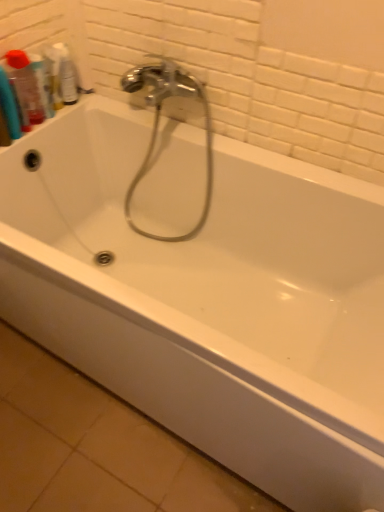
The height and width of the screenshot is (512, 384). Describe the element at coordinates (25, 88) in the screenshot. I see `translucent plastic mouthwash at upper left, the 3th mouthwash in the right-to-left sequence` at that location.

The image size is (384, 512). What do you see at coordinates (66, 75) in the screenshot? I see `clear plastic bottle at upper left, which is counted as the 3th mouthwash, starting from the left` at bounding box center [66, 75].

How much space does clear plastic bottle at upper left, marked as the first mouthwash in a right-to-left arrangement, occupy vertically?

The height of clear plastic bottle at upper left, marked as the first mouthwash in a right-to-left arrangement, is 18.47 centimeters.

Where is `chrome metallic faucet at center`? This screenshot has width=384, height=512. chrome metallic faucet at center is located at coordinates 158,124.

Considering the relative positions of clear plastic bottle at upper left, which is counted as the 3th mouthwash, starting from the left, and chrome metallic faucet at center in the image provided, is clear plastic bottle at upper left, which is counted as the 3th mouthwash, starting from the left, in front of chrome metallic faucet at center?

No, clear plastic bottle at upper left, which is counted as the 3th mouthwash, starting from the left, is behind chrome metallic faucet at center.

The width and height of the screenshot is (384, 512). Identify the location of faucet below the clear plastic bottle at upper left, marked as the first mouthwash in a right-to-left arrangement (from the image's perspective). (158, 124).

Between clear plastic bottle at upper left, which is counted as the 3th mouthwash, starting from the left, and chrome metallic faucet at center, which one appears on the right side from the viewer's perspective?

Positioned to the right is chrome metallic faucet at center.

From a real-world perspective, does clear plastic bottle at upper left, marked as the first mouthwash in a right-to-left arrangement, stand above chrome metallic faucet at center?

Yes, from a real-world perspective, clear plastic bottle at upper left, marked as the first mouthwash in a right-to-left arrangement, is above chrome metallic faucet at center.

Does chrome metallic faucet at center have a greater height compared to translucent plastic mouthwash at upper left, arranged as the 2th mouthwash when viewed from the left?

Indeed, chrome metallic faucet at center has a greater height compared to translucent plastic mouthwash at upper left, arranged as the 2th mouthwash when viewed from the left.

From the picture: From a real-world perspective, does chrome metallic faucet at center sit lower than translucent plastic mouthwash at upper left, arranged as the 2th mouthwash when viewed from the left?

Yes.

Is chrome metallic faucet at center placed right next to translucent plastic mouthwash at upper left, arranged as the 2th mouthwash when viewed from the left?

No, chrome metallic faucet at center is not with translucent plastic mouthwash at upper left, arranged as the 2th mouthwash when viewed from the left.

From the picture: Can you tell me how much translucent plastic mouthwash at upper left, which ranks as the first mouthwash in left-to-right order, and translucent plastic mouthwash at upper left, arranged as the second mouthwash when viewed from the right, differ in facing direction?

translucent plastic mouthwash at upper left, which ranks as the first mouthwash in left-to-right order, and translucent plastic mouthwash at upper left, arranged as the second mouthwash when viewed from the right, are facing 0.000474 degrees away from each other.

Is translucent plastic mouthwash at upper left, which ranks as the first mouthwash in left-to-right order, oriented away from translucent plastic mouthwash at upper left, arranged as the 2th mouthwash when viewed from the left?

translucent plastic mouthwash at upper left, which ranks as the first mouthwash in left-to-right order, is not turned away from translucent plastic mouthwash at upper left, arranged as the 2th mouthwash when viewed from the left.

Does translucent plastic mouthwash at upper left, which ranks as the first mouthwash in left-to-right order, have a lesser height compared to translucent plastic mouthwash at upper left, arranged as the 2th mouthwash when viewed from the left?

In fact, translucent plastic mouthwash at upper left, which ranks as the first mouthwash in left-to-right order, may be taller than translucent plastic mouthwash at upper left, arranged as the 2th mouthwash when viewed from the left.

Does point (8, 64) come in front of point (32, 65)?

Yes, point (8, 64) is closer to viewer.

Is point (70, 86) farther from viewer compared to point (46, 76)?

Yes.

Is clear plastic bottle at upper left, marked as the first mouthwash in a right-to-left arrangement, positioned beyond the bounds of translucent plastic mouthwash at upper left, arranged as the second mouthwash when viewed from the right?

Absolutely, clear plastic bottle at upper left, marked as the first mouthwash in a right-to-left arrangement, is external to translucent plastic mouthwash at upper left, arranged as the second mouthwash when viewed from the right.

The image size is (384, 512). I want to click on the 1st mouthwash to the left of the clear plastic bottle at upper left, which is counted as the 3th mouthwash, starting from the left, starting your count from the anchor, so click(42, 83).

From the image's perspective, is clear plastic bottle at upper left, marked as the first mouthwash in a right-to-left arrangement, beneath translucent plastic mouthwash at upper left, arranged as the second mouthwash when viewed from the right?

No, from the image's perspective, clear plastic bottle at upper left, marked as the first mouthwash in a right-to-left arrangement, is not below translucent plastic mouthwash at upper left, arranged as the second mouthwash when viewed from the right.

Is chrome metallic faucet at center at the back of translucent plastic mouthwash at upper left, the 3th mouthwash in the right-to-left sequence?

No, chrome metallic faucet at center is not at the back of translucent plastic mouthwash at upper left, the 3th mouthwash in the right-to-left sequence.

Is translucent plastic mouthwash at upper left, the 3th mouthwash in the right-to-left sequence, positioned beyond the bounds of chrome metallic faucet at center?

Yes, translucent plastic mouthwash at upper left, the 3th mouthwash in the right-to-left sequence, is outside of chrome metallic faucet at center.

Can you confirm if translucent plastic mouthwash at upper left, the 3th mouthwash in the right-to-left sequence, is positioned to the right of chrome metallic faucet at center?

In fact, translucent plastic mouthwash at upper left, the 3th mouthwash in the right-to-left sequence, is to the left of chrome metallic faucet at center.

Would you say chrome metallic faucet at center is to the left or to the right of clear plastic bottle at upper left, which is counted as the 3th mouthwash, starting from the left, in the picture?

From the image, it's evident that chrome metallic faucet at center is to the right of clear plastic bottle at upper left, which is counted as the 3th mouthwash, starting from the left.

Which mouthwash is the 3rd one when counting from the back of the chrome metallic faucet at center? Please provide its 2D coordinates.

[(66, 75)]

Which is in front, point (122, 85) or point (66, 100)?

The point (66, 100) is closer.

Which object is further away from the camera taking this photo, chrome metallic faucet at center or clear plastic bottle at upper left, which is counted as the 3th mouthwash, starting from the left?

clear plastic bottle at upper left, which is counted as the 3th mouthwash, starting from the left.

Is clear plastic bottle at upper left, which is counted as the 3th mouthwash, starting from the left, placed right next to translucent plastic mouthwash at upper left, the 3th mouthwash in the right-to-left sequence?

No, clear plastic bottle at upper left, which is counted as the 3th mouthwash, starting from the left, is not next to translucent plastic mouthwash at upper left, the 3th mouthwash in the right-to-left sequence.

Is clear plastic bottle at upper left, which is counted as the 3th mouthwash, starting from the left, positioned with its back to translucent plastic mouthwash at upper left, the 3th mouthwash in the right-to-left sequence?

No.

Between clear plastic bottle at upper left, which is counted as the 3th mouthwash, starting from the left, and translucent plastic mouthwash at upper left, which ranks as the first mouthwash in left-to-right order, which one has more height?

translucent plastic mouthwash at upper left, which ranks as the first mouthwash in left-to-right order, is taller.

Find the location of a particular element. faucet below the clear plastic bottle at upper left, which is counted as the 3th mouthwash, starting from the left (from a real-world perspective) is located at coordinates (158, 124).

There is a chrome metallic faucet at center. Where is `the 2nd mouthwash above it (from a real-world perspective)`? This screenshot has width=384, height=512. the 2nd mouthwash above it (from a real-world perspective) is located at coordinates (42, 83).

From the picture: Looking at the image, which one is located further to chrome metallic faucet at center, translucent plastic mouthwash at upper left, which ranks as the first mouthwash in left-to-right order, or clear plastic bottle at upper left, which is counted as the 3th mouthwash, starting from the left?

translucent plastic mouthwash at upper left, which ranks as the first mouthwash in left-to-right order, is positioned further to the anchor chrome metallic faucet at center.

When comparing their distances from translucent plastic mouthwash at upper left, which ranks as the first mouthwash in left-to-right order, does clear plastic bottle at upper left, marked as the first mouthwash in a right-to-left arrangement, or chrome metallic faucet at center seem closer?

clear plastic bottle at upper left, marked as the first mouthwash in a right-to-left arrangement, is closer to translucent plastic mouthwash at upper left, which ranks as the first mouthwash in left-to-right order.

From the image, which object appears to be nearer to clear plastic bottle at upper left, which is counted as the 3th mouthwash, starting from the left, chrome metallic faucet at center or translucent plastic mouthwash at upper left, arranged as the second mouthwash when viewed from the right?

translucent plastic mouthwash at upper left, arranged as the second mouthwash when viewed from the right, lies closer to clear plastic bottle at upper left, which is counted as the 3th mouthwash, starting from the left, than the other object.

From the image, which object appears to be nearer to translucent plastic mouthwash at upper left, arranged as the second mouthwash when viewed from the right, clear plastic bottle at upper left, which is counted as the 3th mouthwash, starting from the left, or translucent plastic mouthwash at upper left, the 3th mouthwash in the right-to-left sequence?

Based on the image, translucent plastic mouthwash at upper left, the 3th mouthwash in the right-to-left sequence, appears to be nearer to translucent plastic mouthwash at upper left, arranged as the second mouthwash when viewed from the right.

Which object lies further to the anchor point translucent plastic mouthwash at upper left, which ranks as the first mouthwash in left-to-right order, translucent plastic mouthwash at upper left, arranged as the 2th mouthwash when viewed from the left, or chrome metallic faucet at center?

Among the two, chrome metallic faucet at center is located further to translucent plastic mouthwash at upper left, which ranks as the first mouthwash in left-to-right order.

From the image, which object appears to be farther from translucent plastic mouthwash at upper left, arranged as the 2th mouthwash when viewed from the left, chrome metallic faucet at center or clear plastic bottle at upper left, marked as the first mouthwash in a right-to-left arrangement?

chrome metallic faucet at center lies further to translucent plastic mouthwash at upper left, arranged as the 2th mouthwash when viewed from the left, than the other object.

From the image, which object appears to be farther from chrome metallic faucet at center, translucent plastic mouthwash at upper left, which ranks as the first mouthwash in left-to-right order, or translucent plastic mouthwash at upper left, arranged as the 2th mouthwash when viewed from the left?

The object further to chrome metallic faucet at center is translucent plastic mouthwash at upper left, which ranks as the first mouthwash in left-to-right order.

Which object lies further to the anchor point chrome metallic faucet at center, translucent plastic mouthwash at upper left, arranged as the second mouthwash when viewed from the right, or clear plastic bottle at upper left, marked as the first mouthwash in a right-to-left arrangement?

translucent plastic mouthwash at upper left, arranged as the second mouthwash when viewed from the right, is positioned further to the anchor chrome metallic faucet at center.

You are a GUI agent. You are given a task and a screenshot of the screen. Output one action in this format:
    pyautogui.click(x=<x>, y=<y>)
    Task: Click on the mouthwash between translucent plastic mouthwash at upper left, arranged as the second mouthwash when viewed from the right, and chrome metallic faucet at center
    
    Given the screenshot: What is the action you would take?
    pyautogui.click(x=66, y=75)

This screenshot has width=384, height=512. In order to click on mouthwash between translucent plastic mouthwash at upper left, the 3th mouthwash in the right-to-left sequence, and clear plastic bottle at upper left, which is counted as the 3th mouthwash, starting from the left, from front to back in this screenshot , I will do `click(42, 83)`.